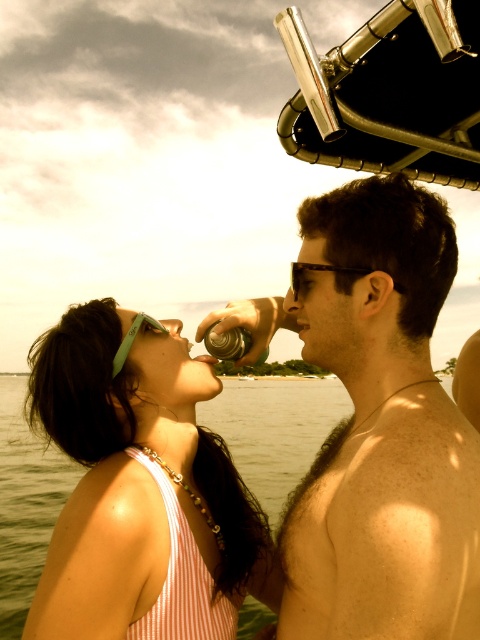
Question: Which point is farther to the camera?

Choices:
 (A) (187, 468)
 (B) (0, 387)
 (C) (303, 300)
 (D) (265, 353)

Answer: (B)

Question: Can you confirm if clear water at center is positioned above metallic silver can at center?

Choices:
 (A) yes
 (B) no

Answer: (B)

Question: Can you confirm if shiny metallic hair at right is wider than matte pink tank top at center?

Choices:
 (A) yes
 (B) no

Answer: (B)

Question: Is matte pink tank top at center to the left of metallic silver can at center from the viewer's perspective?

Choices:
 (A) yes
 (B) no

Answer: (A)

Question: Which object is the closest to the metallic silver can at center?

Choices:
 (A) clear water at center
 (B) matte pink tank top at center
 (C) shiny metallic hair at right

Answer: (C)

Question: Estimate the real-world distances between objects in this image. Which object is closer to the metallic silver can at center?

Choices:
 (A) shiny metallic hair at right
 (B) matte pink tank top at center
 (C) clear water at center

Answer: (A)